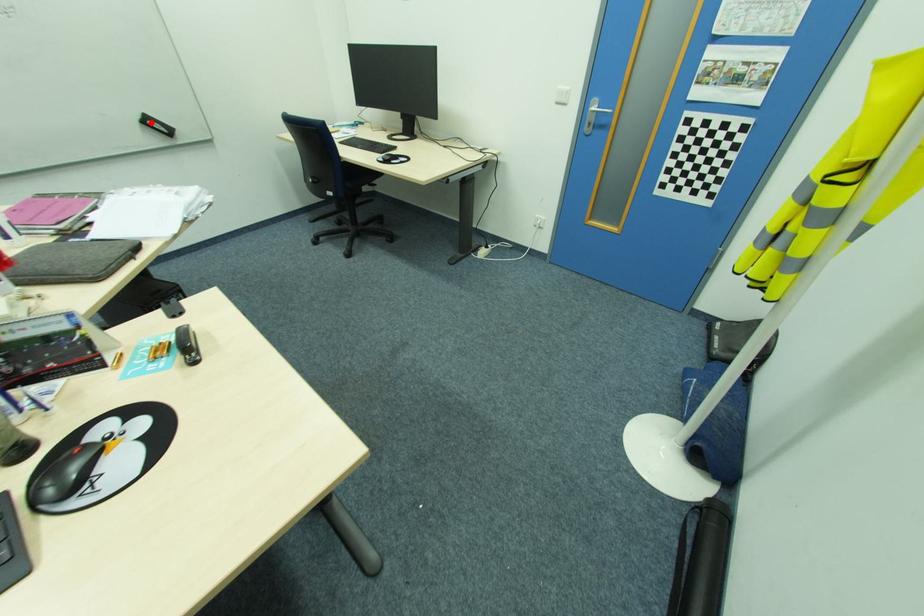
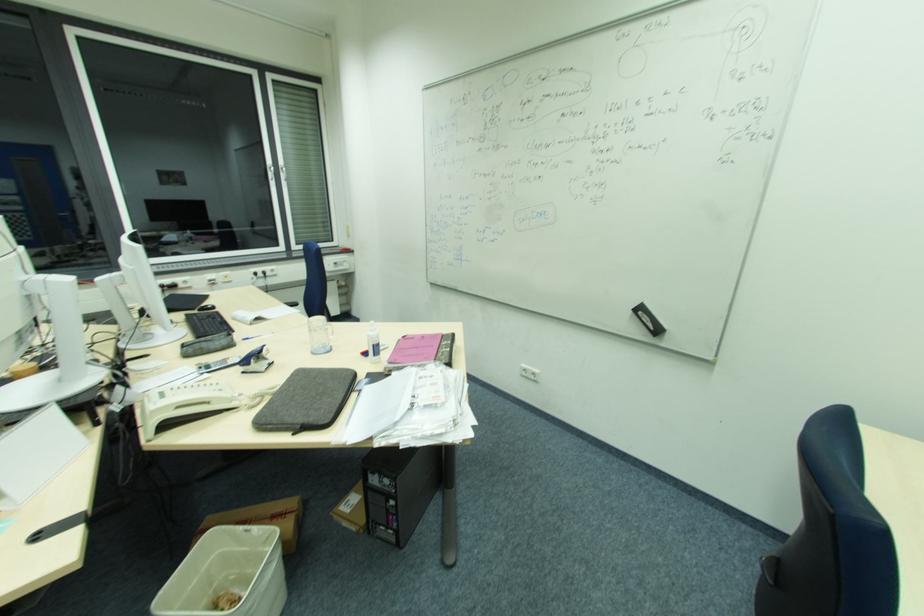
In the second image, find the point that corresponds to the highlighted location in the first image.

(643, 314)